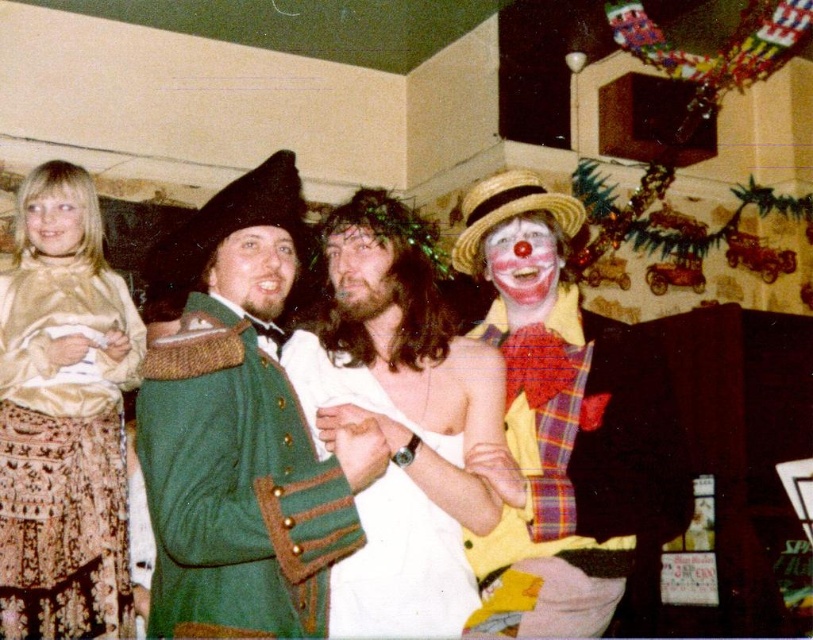
Looking at this image, you are organizing a costume party and need to ensure that all clothing items are displayed properly. Given the green woolen coat at center and the white fabric shirt at center, which item requires a larger display space due to its size?

The green woolen coat at center requires a larger display space because it has a larger size compared to the white fabric shirt at center.